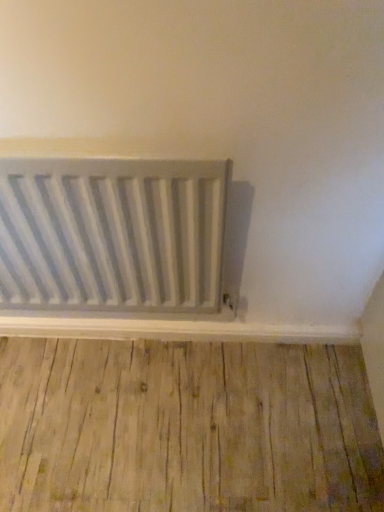
The width and height of the screenshot is (384, 512). What do you see at coordinates (186, 426) in the screenshot? I see `light brown wood flooring at lower center` at bounding box center [186, 426].

Find the location of a particular element. light brown wood flooring at lower center is located at coordinates (186, 426).

Describe the element at coordinates (112, 234) in the screenshot. I see `white matte radiator at center` at that location.

Find the location of a particular element. The image size is (384, 512). white matte radiator at center is located at coordinates (112, 234).

The height and width of the screenshot is (512, 384). What are the coordinates of `light brown wood flooring at lower center` in the screenshot? It's located at (186, 426).

Based on the photo, which object is positioned more to the right, white matte radiator at center or light brown wood flooring at lower center?

light brown wood flooring at lower center.

Which object is more forward, white matte radiator at center or light brown wood flooring at lower center?

Positioned in front is white matte radiator at center.

Which is closer to the camera, (212, 236) or (143, 385)?

The point (212, 236) is more forward.

From the image's perspective, which object appears higher, white matte radiator at center or light brown wood flooring at lower center?

From the image's view, white matte radiator at center is above.

From a real-world perspective, is white matte radiator at center under light brown wood flooring at lower center?

No, from a real-world perspective, white matte radiator at center is not below light brown wood flooring at lower center.

Which of these two, white matte radiator at center or light brown wood flooring at lower center, is wider?

Wider between the two is light brown wood flooring at lower center.

Who is shorter, white matte radiator at center or light brown wood flooring at lower center?

With less height is light brown wood flooring at lower center.

Based on their sizes in the image, would you say white matte radiator at center is bigger or smaller than light brown wood flooring at lower center?

Clearly, white matte radiator at center is larger in size than light brown wood flooring at lower center.

Looking at this image, is white matte radiator at center positioned beyond the bounds of light brown wood flooring at lower center?

Yes, white matte radiator at center is outside of light brown wood flooring at lower center.

Is the surface of white matte radiator at center in direct contact with light brown wood flooring at lower center?

No, white matte radiator at center is not next to light brown wood flooring at lower center.

Is light brown wood flooring at lower center at the back of white matte radiator at center?

No, white matte radiator at center is not facing away from light brown wood flooring at lower center.

Can you tell me how much white matte radiator at center and light brown wood flooring at lower center differ in facing direction?

179 degrees separate the facing orientations of white matte radiator at center and light brown wood flooring at lower center.

You are a GUI agent. You are given a task and a screenshot of the screen. Output one action in this format:
    pyautogui.click(x=<x>, y=<y>)
    Task: Click on the hardwood below the white matte radiator at center (from the image's perspective)
    
    Given the screenshot: What is the action you would take?
    pyautogui.click(x=186, y=426)

In the image, is light brown wood flooring at lower center on the left side or the right side of white matte radiator at center?

Based on their positions, light brown wood flooring at lower center is located to the right of white matte radiator at center.

Consider the image. Which is behind, light brown wood flooring at lower center or white matte radiator at center?

Positioned behind is light brown wood flooring at lower center.

Is point (265, 462) closer or farther from the camera than point (226, 200)?

Point (265, 462).

From the image's perspective, is light brown wood flooring at lower center below white matte radiator at center?

Indeed, from the image's perspective, light brown wood flooring at lower center is shown beneath white matte radiator at center.

From a real-world perspective, does light brown wood flooring at lower center stand above white matte radiator at center?

No, from a real-world perspective, light brown wood flooring at lower center is not over white matte radiator at center

Looking at their sizes, would you say light brown wood flooring at lower center is wider or thinner than white matte radiator at center?

Considering their sizes, light brown wood flooring at lower center looks broader than white matte radiator at center.

Is light brown wood flooring at lower center taller than white matte radiator at center?

No, light brown wood flooring at lower center is not taller than white matte radiator at center.

Considering the sizes of objects light brown wood flooring at lower center and white matte radiator at center in the image provided, who is smaller, light brown wood flooring at lower center or white matte radiator at center?

light brown wood flooring at lower center is smaller.

Can white matte radiator at center be found inside light brown wood flooring at lower center?

Definitely not — white matte radiator at center is not inside light brown wood flooring at lower center.

Is there a large distance between light brown wood flooring at lower center and white matte radiator at center?

light brown wood flooring at lower center is near white matte radiator at center, not far away.

Is light brown wood flooring at lower center turned away from white matte radiator at center?

No, light brown wood flooring at lower center is not facing away from white matte radiator at center.

Measure the distance from light brown wood flooring at lower center to white matte radiator at center.

light brown wood flooring at lower center and white matte radiator at center are 18.64 inches apart from each other.

You are a GUI agent. You are given a task and a screenshot of the screen. Output one action in this format:
    pyautogui.click(x=<x>, y=<y>)
    Task: Click on the hardwood below the white matte radiator at center (from the image's perspective)
    The image size is (384, 512).
    Given the screenshot: What is the action you would take?
    pyautogui.click(x=186, y=426)

Where is `radiator above the light brown wood flooring at lower center (from the image's perspective)`? The height and width of the screenshot is (512, 384). radiator above the light brown wood flooring at lower center (from the image's perspective) is located at coordinates pos(112,234).

Where is `radiator above the light brown wood flooring at lower center (from a real-world perspective)`? Image resolution: width=384 pixels, height=512 pixels. radiator above the light brown wood flooring at lower center (from a real-world perspective) is located at coordinates (112, 234).